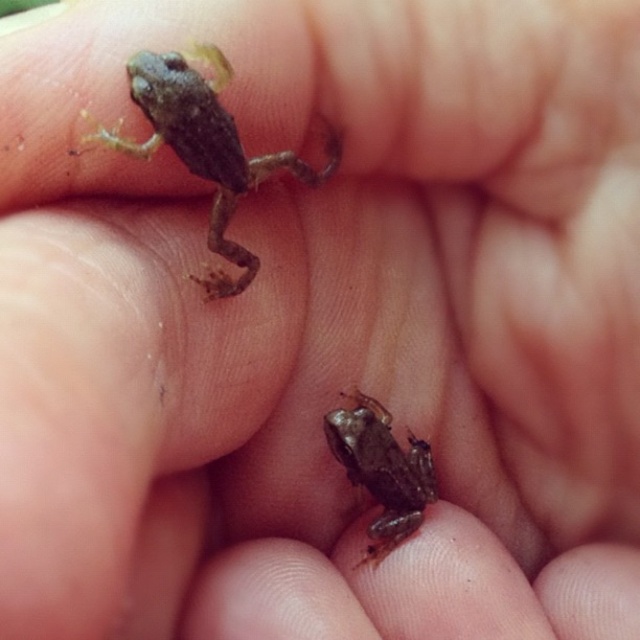
You are a GUI agent. You are given a task and a screenshot of the screen. Output one action in this format:
    pyautogui.click(x=<x>, y=<y>)
    Task: Click on the smooth brown frog at upper left
    
    Given the screenshot: What is the action you would take?
    pyautogui.click(x=205, y=145)

Is point (324, 147) less distant than point (369, 435)?

Yes, point (324, 147) is in front of point (369, 435).

Which is behind, point (212, 74) or point (360, 420)?

Positioned behind is point (360, 420).

The width and height of the screenshot is (640, 640). Find the location of `smooth brown frog at upper left`. smooth brown frog at upper left is located at coordinates pos(205,145).